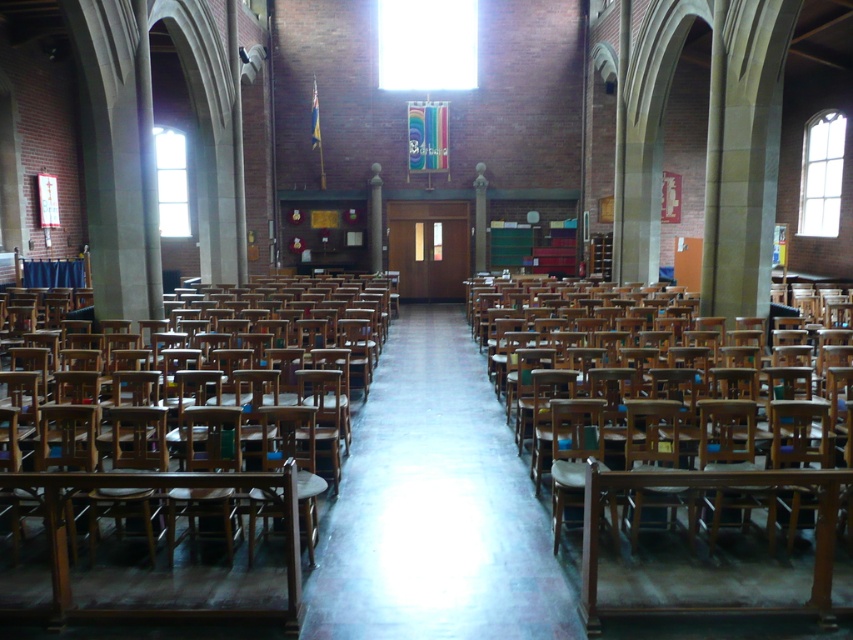
Does wooden at center have a greater height compared to wooden at right?

Indeed, wooden at center has a greater height compared to wooden at right.

Does wooden at center appear over wooden at right?

Yes.

The height and width of the screenshot is (640, 853). Identify the location of wooden at center. (171, 502).

Find the location of `wooden at center`. wooden at center is located at coordinates (171, 502).